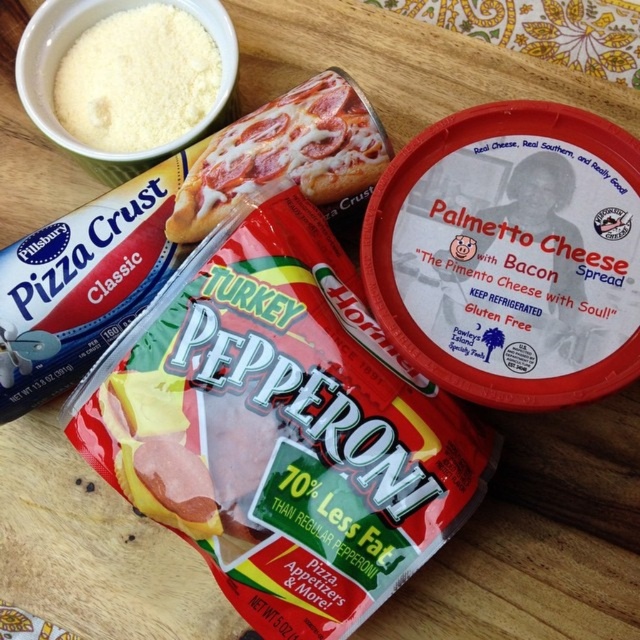
Can you confirm if shiny metallic pizza at center is taller than white powder at upper left?

Indeed, shiny metallic pizza at center has a greater height compared to white powder at upper left.

At what (x,y) coordinates should I click in order to perform the action: click on shiny metallic pizza at center. Please return your answer as a coordinate pair (x, y). This screenshot has height=640, width=640. Looking at the image, I should click on (285, 156).

This screenshot has height=640, width=640. I want to click on shiny metallic pizza at center, so click(x=285, y=156).